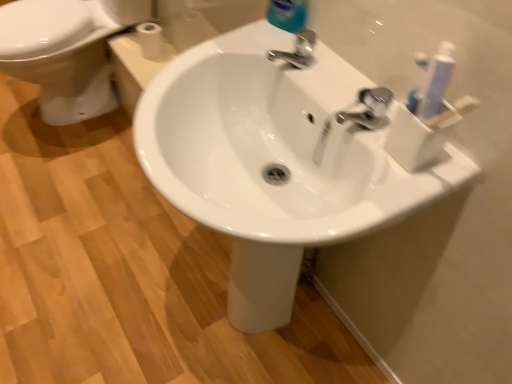
At what (x,y) coordinates should I click in order to perform the action: click on free space between polished chrome faucet at upper right, acting as the 1th tap starting from the front, and silver metallic faucet at upper center, the 2th tap in the right-to-left sequence. Please return your answer as a coordinate pair (x, y). This screenshot has width=512, height=384. Looking at the image, I should click on (326, 78).